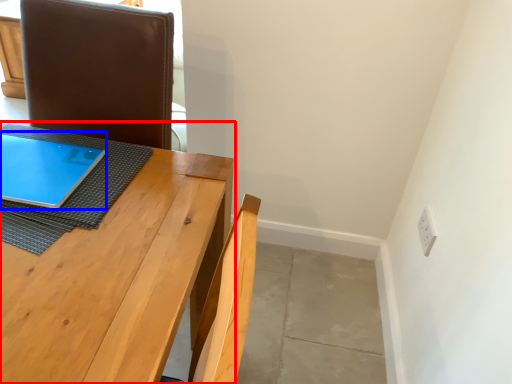
Question: Among these objects, which one is nearest to the camera, table (highlighted by a red box) or tablet computer (highlighted by a blue box)?

Choices:
 (A) table
 (B) tablet computer

Answer: (A)